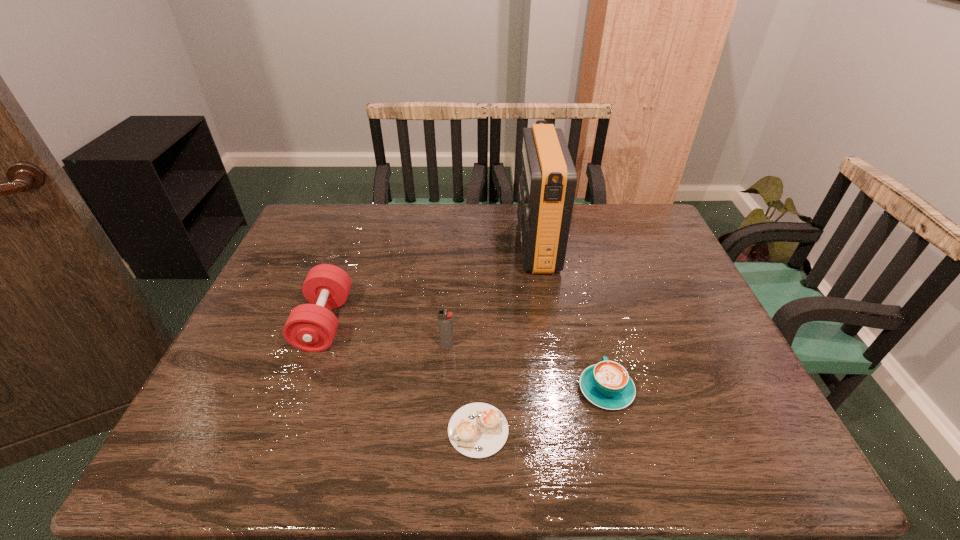
The height and width of the screenshot is (540, 960). What are the coordinates of `vacant area located on the front-facing side of the farthest object` in the screenshot? It's located at (462, 245).

Locate an element on the screen. blank space located 0.400m on the left of the igniter is located at coordinates (279, 345).

Identify the location of vacant region located on the back of the dumbbell. (361, 221).

Locate an element on the screen. free region located with the handle on the right side of the taller cappuccino is located at coordinates (582, 295).

In order to click on free space located with the handle on the right side of the taller cappuccino in this screenshot , I will do `click(588, 316)`.

Where is `vacant space situated 0.300m with the handle on the right side of the taller cappuccino`? vacant space situated 0.300m with the handle on the right side of the taller cappuccino is located at coordinates (579, 284).

This screenshot has height=540, width=960. In order to click on free point located on the right of the shortest object in this screenshot , I will do `click(623, 430)`.

The width and height of the screenshot is (960, 540). What are the coordinates of `object present at the far edge` in the screenshot? It's located at (547, 185).

At what (x,y) coordinates should I click in order to perform the action: click on object that is at the near edge. Please return your answer as a coordinate pair (x, y). The height and width of the screenshot is (540, 960). Looking at the image, I should click on (477, 430).

This screenshot has width=960, height=540. What are the coordinates of `object present at the left edge` in the screenshot? It's located at (312, 327).